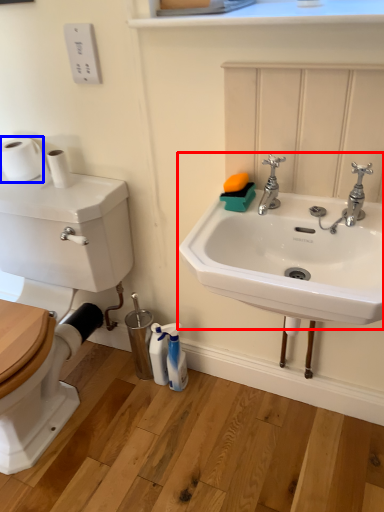
Question: Which of the following is the farthest to the observer, sink (highlighted by a red box) or toilet paper (highlighted by a blue box)?

Choices:
 (A) sink
 (B) toilet paper

Answer: (B)